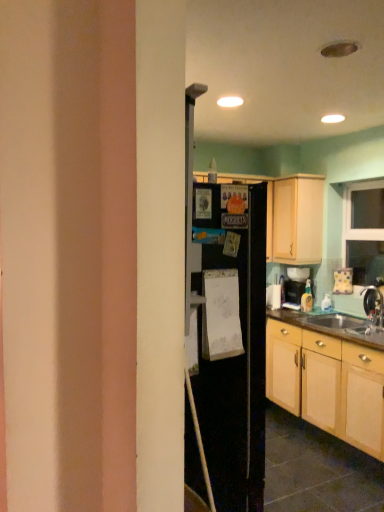
This screenshot has width=384, height=512. I want to click on free spot above brown wood countertop at lower right (from a real-world perspective), so click(x=355, y=327).